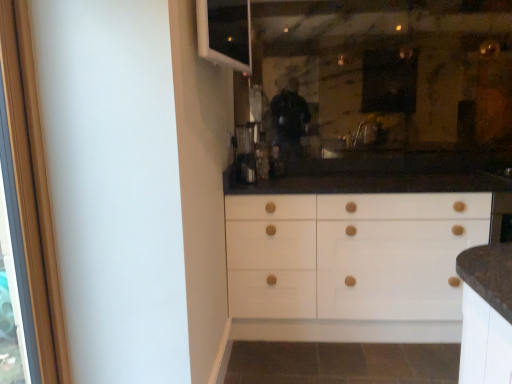
This screenshot has height=384, width=512. Identify the location of metallic silver coffee machine at center. (247, 151).

At what (x,y) coordinates should I click in order to perform the action: click on wooden screen door at left. Please return your answer as a coordinate pair (x, y). Image resolution: width=512 pixels, height=384 pixels. Looking at the image, I should click on (32, 189).

Which is more distant, (25, 99) or (238, 175)?

The point (238, 175) is more distant.

Based on their positions, is wooden screen door at left located to the left or right of metallic silver coffee machine at center?

Clearly, wooden screen door at left is on the left of metallic silver coffee machine at center in the image.

Can metallic silver coffee machine at center be found inside wooden screen door at left?

Actually, metallic silver coffee machine at center is outside wooden screen door at left.

Consider the image. From a real-world perspective, which is physically above, wooden screen door at left or white plastic window at upper left?

In real-world perspective, white plastic window at upper left is above.

From the image's perspective, is wooden screen door at left below white plastic window at upper left?

Indeed, from the image's perspective, wooden screen door at left is shown beneath white plastic window at upper left.

Considering the relative positions of wooden screen door at left and white plastic window at upper left in the image provided, is wooden screen door at left to the right of white plastic window at upper left from the viewer's perspective?

In fact, wooden screen door at left is to the left of white plastic window at upper left.

Which is nearer, (234, 138) or (42, 274)?

Point (234, 138).

Consider the image. Which of these two, metallic silver coffee machine at center or wooden screen door at left, stands shorter?

metallic silver coffee machine at center is shorter.

From a real-world perspective, is metallic silver coffee machine at center positioned over wooden screen door at left based on gravity?

Indeed, from a real-world perspective, metallic silver coffee machine at center stands above wooden screen door at left.

Who is bigger, metallic silver coffee machine at center or wooden screen door at left?

With larger size is wooden screen door at left.

Does point (246, 157) appear closer or farther from the camera than point (200, 34)?

Clearly, point (246, 157) is more distant from the camera than point (200, 34).

Considering the relative sizes of metallic silver coffee machine at center and white plastic window at upper left in the image provided, is metallic silver coffee machine at center wider than white plastic window at upper left?

Indeed, metallic silver coffee machine at center has a greater width compared to white plastic window at upper left.

In terms of size, does metallic silver coffee machine at center appear bigger or smaller than white plastic window at upper left?

Considering their sizes, metallic silver coffee machine at center takes up less space than white plastic window at upper left.

From a real-world perspective, which object rests below the other?

metallic silver coffee machine at center, from a real-world perspective.

Which is in front, white plastic window at upper left or wooden screen door at left?

Positioned in front is wooden screen door at left.

Is white plastic window at upper left placed right next to wooden screen door at left?

No, white plastic window at upper left is not beside wooden screen door at left.

From a real-world perspective, is white plastic window at upper left located higher than wooden screen door at left?

Yes, from a real-world perspective, white plastic window at upper left is on top of wooden screen door at left.

Considering the positions of point (212, 22) and point (26, 54), is point (212, 22) closer or farther from the camera than point (26, 54)?

Clearly, point (212, 22) is more distant from the camera than point (26, 54).

From the image's perspective, which one is positioned lower, white plastic window at upper left or metallic silver coffee machine at center?

metallic silver coffee machine at center appears lower in the image.

The width and height of the screenshot is (512, 384). What are the coordinates of `coffee machine on the right of white plastic window at upper left` in the screenshot? It's located at (247, 151).

Which object is positioned more to the left, white plastic window at upper left or metallic silver coffee machine at center?

From the viewer's perspective, white plastic window at upper left appears more on the left side.

Is white plastic window at upper left turned away from metallic silver coffee machine at center?

No, white plastic window at upper left's orientation is not away from metallic silver coffee machine at center.

The image size is (512, 384). What are the coordinates of `screen door in front of the metallic silver coffee machine at center` in the screenshot? It's located at (32, 189).

The height and width of the screenshot is (384, 512). I want to click on screen door below the white plastic window at upper left (from the image's perspective), so click(32, 189).

Considering their positions, is white plastic window at upper left positioned closer to metallic silver coffee machine at center than wooden screen door at left?

Based on the image, white plastic window at upper left appears to be nearer to metallic silver coffee machine at center.

Which object lies nearer to the anchor point white plastic window at upper left, metallic silver coffee machine at center or wooden screen door at left?

Among the two, metallic silver coffee machine at center is located nearer to white plastic window at upper left.

Considering their positions, is wooden screen door at left positioned further to metallic silver coffee machine at center than white plastic window at upper left?

Among the two, wooden screen door at left is located further to metallic silver coffee machine at center.

Considering their positions, is metallic silver coffee machine at center positioned further to wooden screen door at left than white plastic window at upper left?

Among the two, metallic silver coffee machine at center is located further to wooden screen door at left.

From the image, which object appears to be farther from white plastic window at upper left, wooden screen door at left or metallic silver coffee machine at center?

wooden screen door at left is positioned further to the anchor white plastic window at upper left.

Which object lies further to the anchor point wooden screen door at left, white plastic window at upper left or metallic silver coffee machine at center?

metallic silver coffee machine at center is positioned further to the anchor wooden screen door at left.

This screenshot has width=512, height=384. In order to click on window between wooden screen door at left and metallic silver coffee machine at center from front to back in this screenshot , I will do `click(225, 32)`.